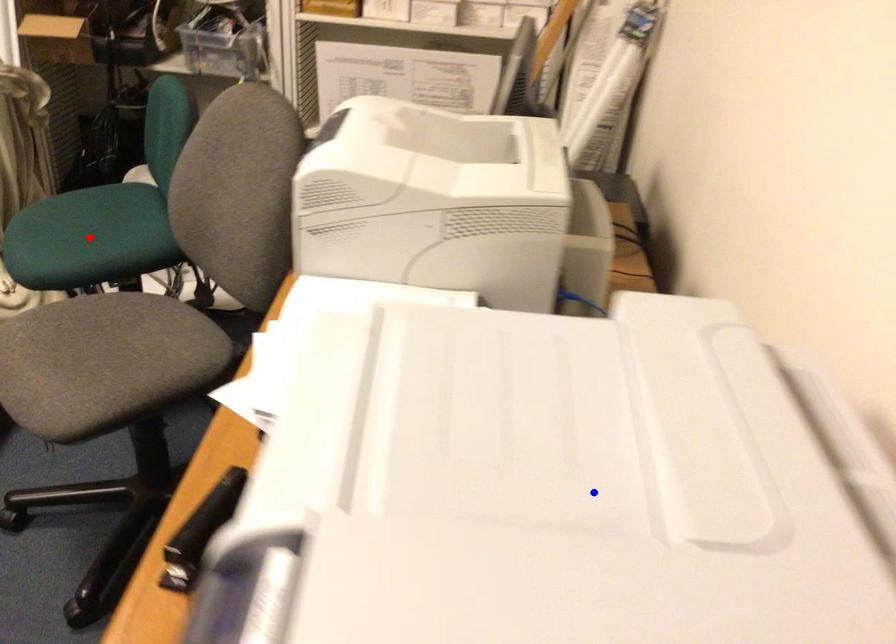
Question: Which of the two points in the image is closer to the camera?

Choices:
 (A) Blue point is closer.
 (B) Red point is closer.

Answer: (A)